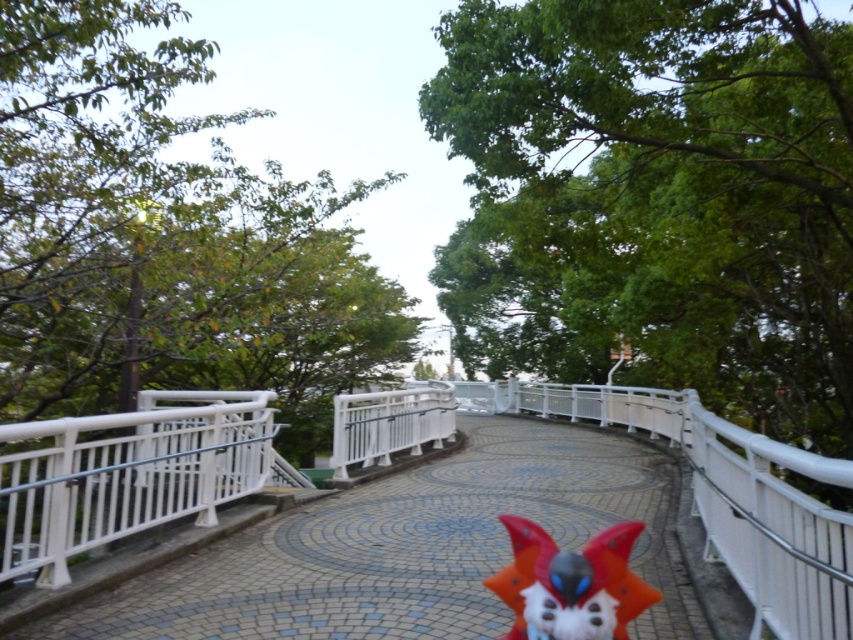
Question: Is white glossy bridge at center smaller than shiny red plush toy at center?

Choices:
 (A) yes
 (B) no

Answer: (B)

Question: Which point appears closest to the camera in this image?

Choices:
 (A) (456, 592)
 (B) (624, 545)

Answer: (B)

Question: Does white glossy bridge at center appear under shiny red plush toy at center?

Choices:
 (A) yes
 (B) no

Answer: (A)

Question: In this image, where is white glossy bridge at center located relative to shiny red plush toy at center?

Choices:
 (A) left
 (B) right

Answer: (B)

Question: Which point is closer to the camera?

Choices:
 (A) white glossy bridge at center
 (B) shiny red plush toy at center

Answer: (B)